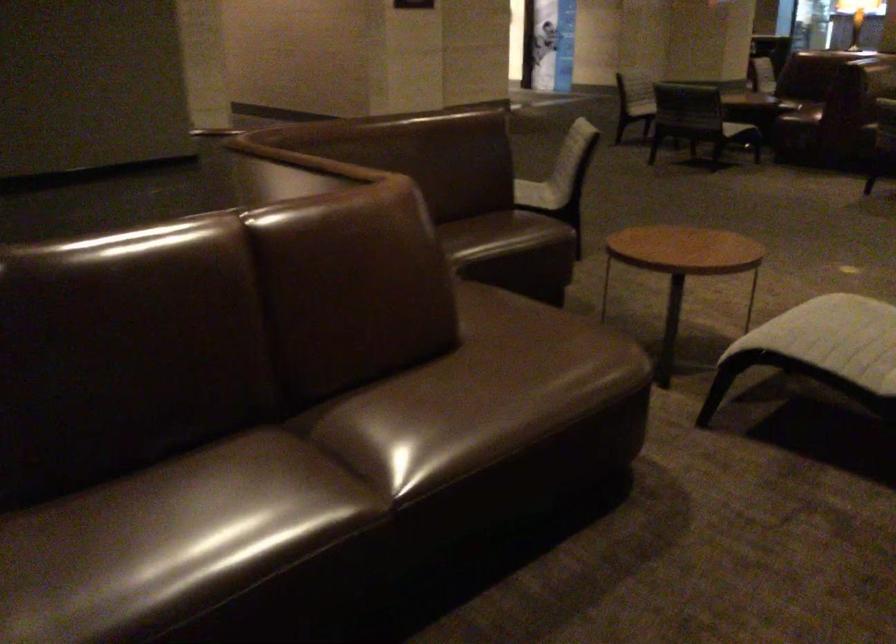
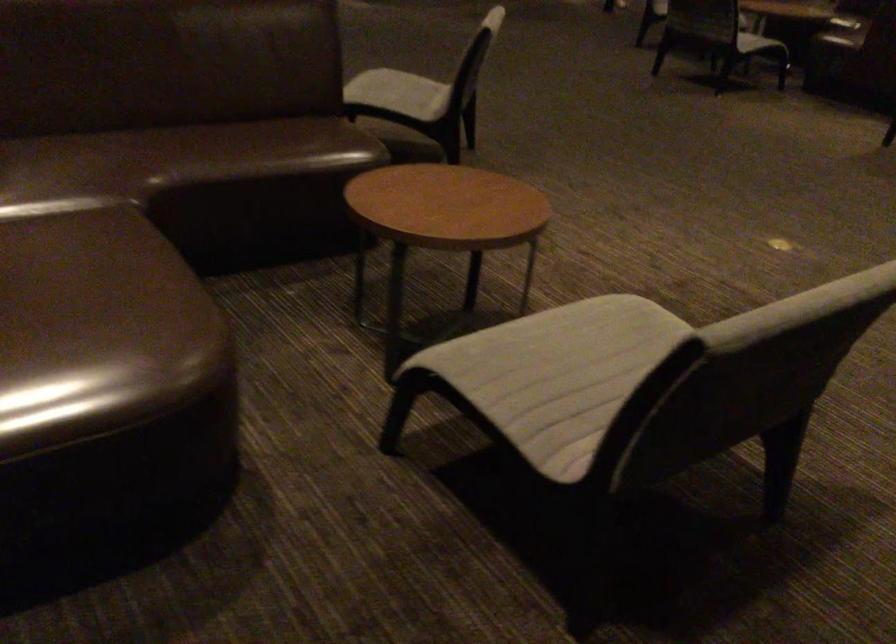
Locate, in the second image, the point that corresponds to point (529, 184) in the first image.

(399, 93)